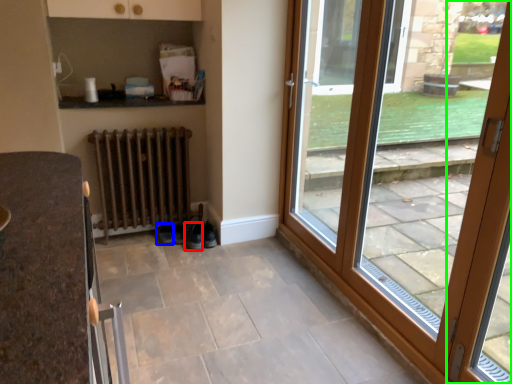
Question: Which object is the closest to the shoe (highlighted by a red box)? Choose among these: shoe (highlighted by a blue box) or door (highlighted by a green box).

Choices:
 (A) shoe
 (B) door

Answer: (A)